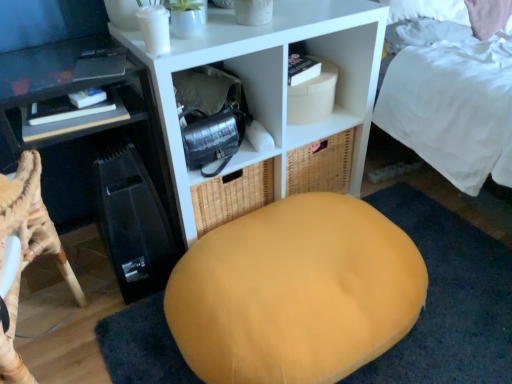
Question: Are white matte shelf at center, the first shelf from the right, and matte black desk at left far apart?

Choices:
 (A) no
 (B) yes

Answer: (A)

Question: Is matte black desk at left inside white matte shelf at center, which is counted as the 2th shelf, starting from the left?

Choices:
 (A) yes
 (B) no

Answer: (B)

Question: Considering the relative positions of white matte shelf at center, which is counted as the 2th shelf, starting from the left, and matte black desk at left in the image provided, is white matte shelf at center, which is counted as the 2th shelf, starting from the left, to the right of matte black desk at left from the viewer's perspective?

Choices:
 (A) yes
 (B) no

Answer: (A)

Question: Could you tell me if white matte shelf at center, the first shelf from the right, is turned towards matte black desk at left?

Choices:
 (A) no
 (B) yes

Answer: (A)

Question: Is white matte shelf at center, which is counted as the 2th shelf, starting from the left, located outside matte black desk at left?

Choices:
 (A) no
 (B) yes

Answer: (B)

Question: From the image's perspective, relative to matte black desk at left, is white matte shelf at center, which is counted as the 2th shelf, starting from the left, above or below?

Choices:
 (A) below
 (B) above

Answer: (B)

Question: Is white matte shelf at center, the first shelf from the right, to the left or to the right of matte black desk at left in the image?

Choices:
 (A) right
 (B) left

Answer: (A)

Question: Considering their positions, is white matte shelf at center, which is counted as the 2th shelf, starting from the left, located in front of or behind matte black desk at left?

Choices:
 (A) behind
 (B) front

Answer: (A)

Question: In terms of height, does white matte shelf at center, the first shelf from the right, look taller or shorter compared to matte black desk at left?

Choices:
 (A) short
 (B) tall

Answer: (A)

Question: From a real-world perspective, relative to velvet yellow bean bag at center, is black plastic shelf at left, the first shelf in the left-to-right sequence, vertically above or below?

Choices:
 (A) below
 (B) above

Answer: (B)

Question: Is black plastic shelf at left, marked as the 2th shelf in a right-to-left arrangement, in front of or behind velvet yellow bean bag at center in the image?

Choices:
 (A) front
 (B) behind

Answer: (B)

Question: Considering the positions of black plastic shelf at left, the first shelf in the left-to-right sequence, and velvet yellow bean bag at center in the image, is black plastic shelf at left, the first shelf in the left-to-right sequence, wider or thinner than velvet yellow bean bag at center?

Choices:
 (A) thin
 (B) wide

Answer: (A)

Question: Is black plastic shelf at left, the first shelf in the left-to-right sequence, taller or shorter than velvet yellow bean bag at center?

Choices:
 (A) tall
 (B) short

Answer: (A)

Question: From their relative heights in the image, would you say matte black desk at left is taller or shorter than white matte shelf at center, the first shelf from the right?

Choices:
 (A) tall
 (B) short

Answer: (A)

Question: Would you say matte black desk at left is inside or outside white matte shelf at center, the first shelf from the right?

Choices:
 (A) inside
 (B) outside

Answer: (B)